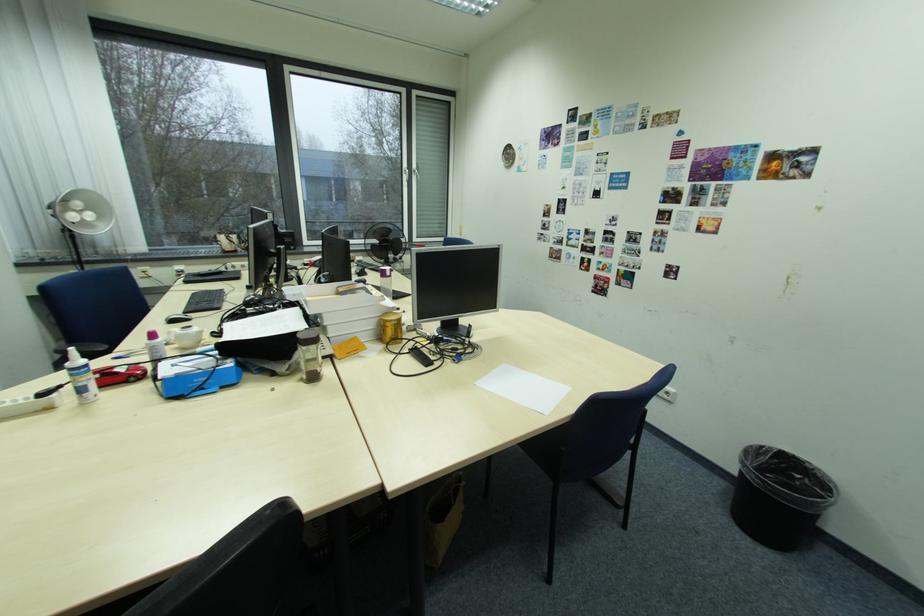
Identify the location of red toy car. The height and width of the screenshot is (616, 924). (119, 374).